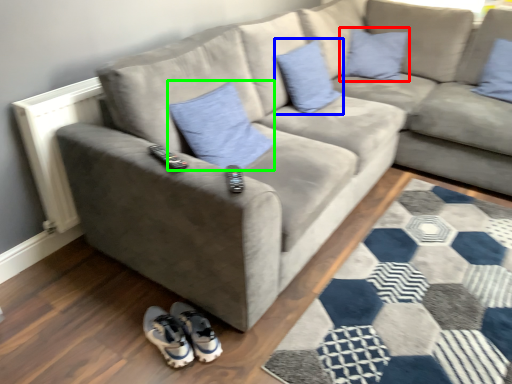
Question: Which object is the closest to the pillow (highlighted by a red box)? Choose among these: pillow (highlighted by a blue box) or pillow (highlighted by a green box).

Choices:
 (A) pillow
 (B) pillow

Answer: (A)